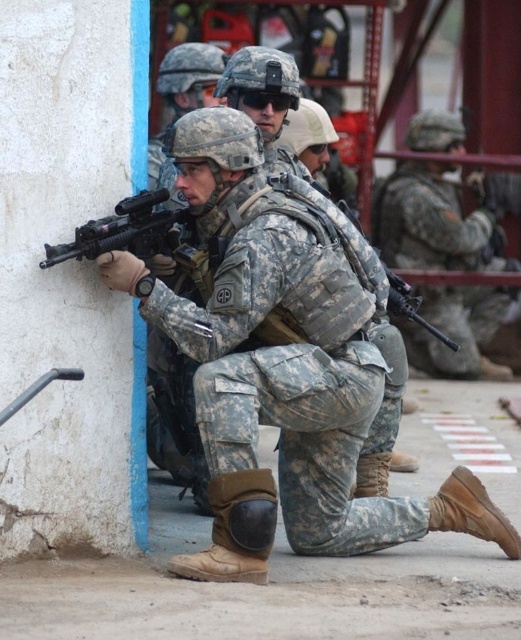
You are a military analyst observing the tactical operation. You notice the camouflage uniform at center and the matte black rifle at left. Which object is located to the right of the other?

The camouflage uniform at center is positioned on the right side of matte black rifle at left.

You are a military analyst assessing the tactical setup in the image. You notice the camouflage uniform at center and the matte black rifle at left. Which object occupies more horizontal space in the image?

The camouflage uniform at center occupies more horizontal space than the matte black rifle at left because its width is larger.